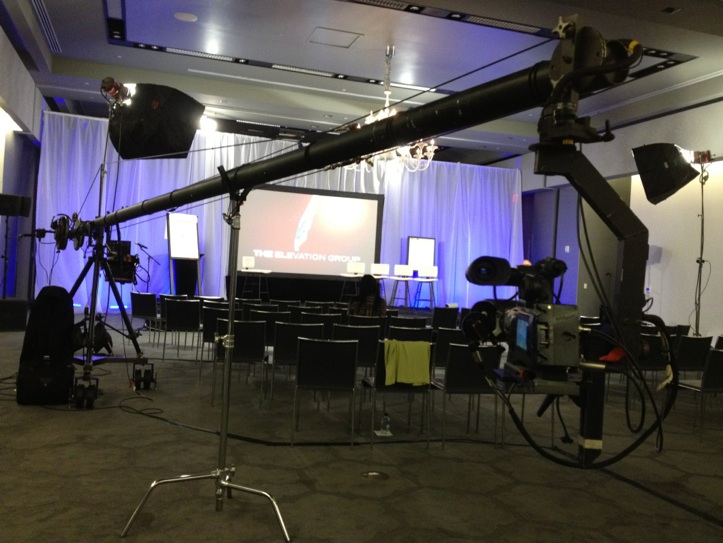
Where is `screen`? The width and height of the screenshot is (723, 543). screen is located at coordinates (286, 248).